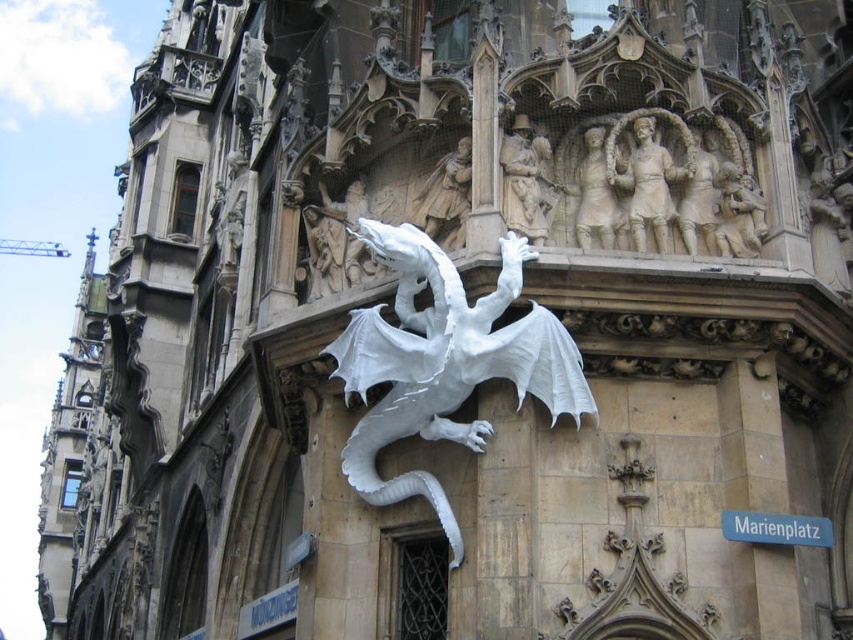
Who is positioned more to the right, white stone dragon at center or white stone relief figures at upper center?

Positioned to the right is white stone relief figures at upper center.

Does white stone dragon at center have a lesser width compared to white stone relief figures at upper center?

No.

You are a GUI agent. You are given a task and a screenshot of the screen. Output one action in this format:
    pyautogui.click(x=<x>, y=<y>)
    Task: Click on the white stone dragon at center
    The width and height of the screenshot is (853, 640).
    Given the screenshot: What is the action you would take?
    pyautogui.click(x=444, y=362)

The height and width of the screenshot is (640, 853). I want to click on white stone dragon at center, so click(444, 362).

Which is above, white stone dragon at center or blue plastic sign at lower right?

white stone dragon at center is above.

Between point (450, 531) and point (827, 540), which one is positioned in front?

Positioned in front is point (827, 540).

Identify the location of white stone dragon at center. (444, 362).

Between sculpted stone figures at upper center and white stone relief figures at upper center, which one is positioned higher?

sculpted stone figures at upper center is higher up.

In the scene shown: Is sculpted stone figures at upper center bigger than white stone relief figures at upper center?

Actually, sculpted stone figures at upper center might be smaller than white stone relief figures at upper center.

Where is `sculpted stone figures at upper center`? This screenshot has width=853, height=640. sculpted stone figures at upper center is located at coordinates (648, 176).